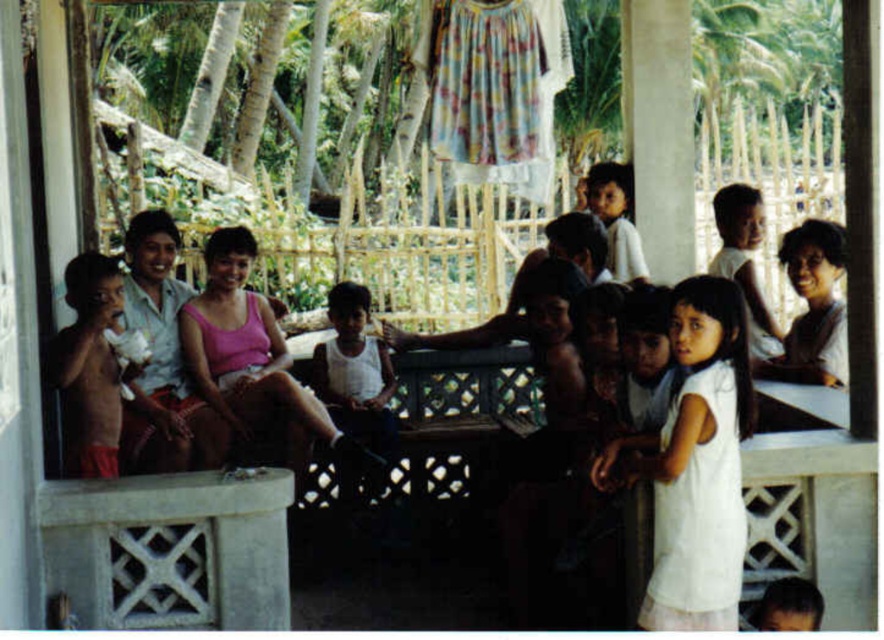
Question: Which of the following is the closest to the observer?

Choices:
 (A) smooth white shirt at right
 (B) white cotton dress at lower right

Answer: (B)

Question: Is white cotton dress at lower right above smooth white shirt at right?

Choices:
 (A) no
 (B) yes

Answer: (A)

Question: Which of the following is the closest to the observer?

Choices:
 (A) (709, 305)
 (B) (790, 273)
 (C) (759, 234)

Answer: (A)

Question: Is smooth white shirt at right to the right of light brown skin at upper right from the viewer's perspective?

Choices:
 (A) no
 (B) yes

Answer: (B)

Question: In this image, where is smooth white shirt at right located relative to light brown skin at upper right?

Choices:
 (A) below
 (B) above

Answer: (A)

Question: Which point is closer to the camera?

Choices:
 (A) (756, 348)
 (B) (781, 356)

Answer: (B)